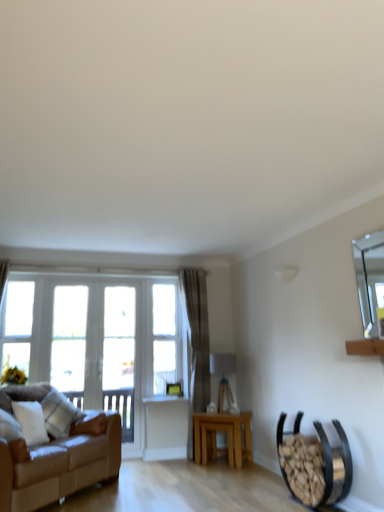
The width and height of the screenshot is (384, 512). In order to click on vacant region above white painted wood window frame at center (from a real-world perspective) in this screenshot , I will do `click(129, 280)`.